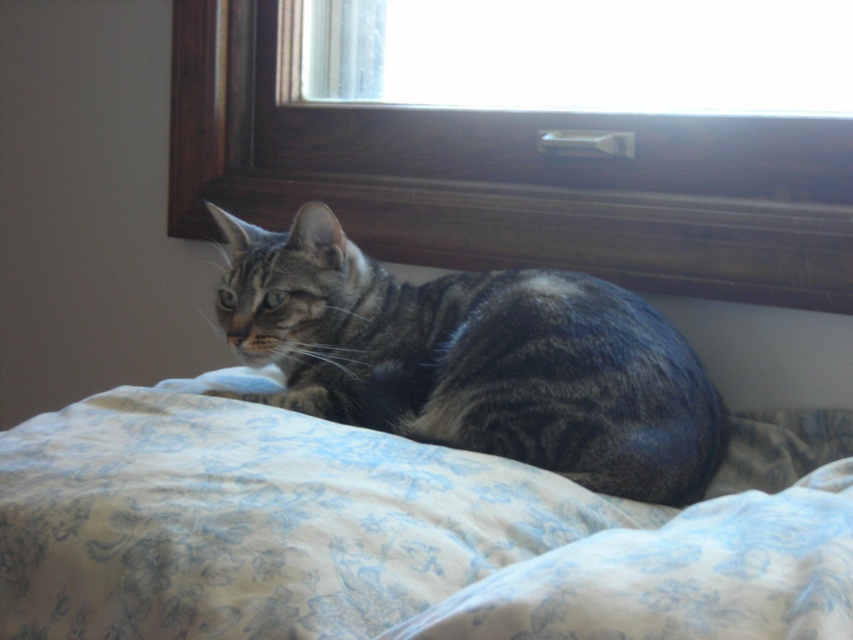
You are a photographer positioned at the window. You want to take a photo of the tabby cat. You notice two points in the scene labeled as point 1 and point 2. Point 1 is at coordinates point (416, 600) and point 2 is at coordinates point (538, 28). Which point is closer to you?

Point 1 at coordinates point (416, 600) is closer to you because it is in front of point 2 at coordinates point (538, 28).